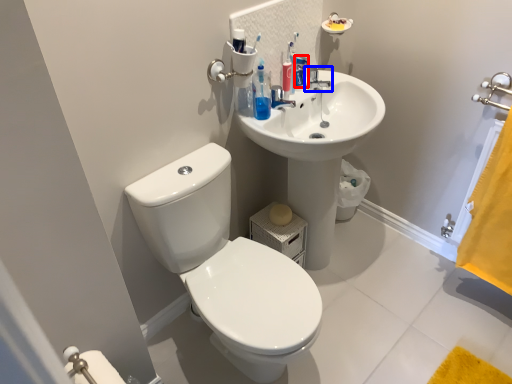
Question: Which object is closer to the camera taking this photo, toiletry (highlighted by a red box) or tap (highlighted by a blue box)?

Choices:
 (A) toiletry
 (B) tap

Answer: (A)